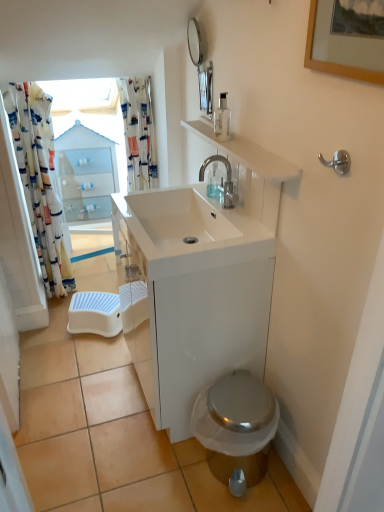
Question: Is white printed fabric shower curtain at left, positioned as the second shower curtain in right-to-left order, positioned with its back to white glossy cabinet at upper center?

Choices:
 (A) no
 (B) yes

Answer: (A)

Question: Is white printed fabric shower curtain at left, placed as the first shower curtain when sorted from left to right, not within white glossy cabinet at upper center?

Choices:
 (A) yes
 (B) no

Answer: (A)

Question: Does white printed fabric shower curtain at left, positioned as the second shower curtain in right-to-left order, appear on the right side of white glossy cabinet at upper center?

Choices:
 (A) yes
 (B) no

Answer: (B)

Question: From the image's perspective, would you say white printed fabric shower curtain at left, positioned as the second shower curtain in right-to-left order, is positioned over white glossy cabinet at upper center?

Choices:
 (A) yes
 (B) no

Answer: (B)

Question: Can you confirm if white printed fabric shower curtain at left, placed as the first shower curtain when sorted from left to right, is smaller than white glossy cabinet at upper center?

Choices:
 (A) yes
 (B) no

Answer: (A)

Question: From a real-world perspective, is white plastic step stool at lower left physically located above or below white glossy cabinet at upper center?

Choices:
 (A) above
 (B) below

Answer: (B)

Question: Is point (94, 295) closer or farther from the camera than point (119, 182)?

Choices:
 (A) closer
 (B) farther

Answer: (A)

Question: Considering the positions of white plastic step stool at lower left and white glossy cabinet at upper center in the image, is white plastic step stool at lower left bigger or smaller than white glossy cabinet at upper center?

Choices:
 (A) small
 (B) big

Answer: (A)

Question: Is white plastic step stool at lower left situated inside white glossy cabinet at upper center or outside?

Choices:
 (A) outside
 (B) inside

Answer: (A)

Question: In the image, is shiny metallic toilet at lower right on the left side or the right side of wooden picture frame at upper right?

Choices:
 (A) left
 (B) right

Answer: (A)

Question: Considering the positions of point (263, 437) and point (326, 61), is point (263, 437) closer or farther from the camera than point (326, 61)?

Choices:
 (A) closer
 (B) farther

Answer: (B)

Question: From the image's perspective, is shiny metallic toilet at lower right positioned above or below wooden picture frame at upper right?

Choices:
 (A) above
 (B) below

Answer: (B)

Question: From their relative heights in the image, would you say shiny metallic toilet at lower right is taller or shorter than wooden picture frame at upper right?

Choices:
 (A) short
 (B) tall

Answer: (A)

Question: Does point (216, 135) appear closer or farther from the camera than point (316, 64)?

Choices:
 (A) farther
 (B) closer

Answer: (A)

Question: Would you say transparent glass soap dispenser at upper center is inside or outside wooden picture frame at upper right?

Choices:
 (A) outside
 (B) inside

Answer: (A)